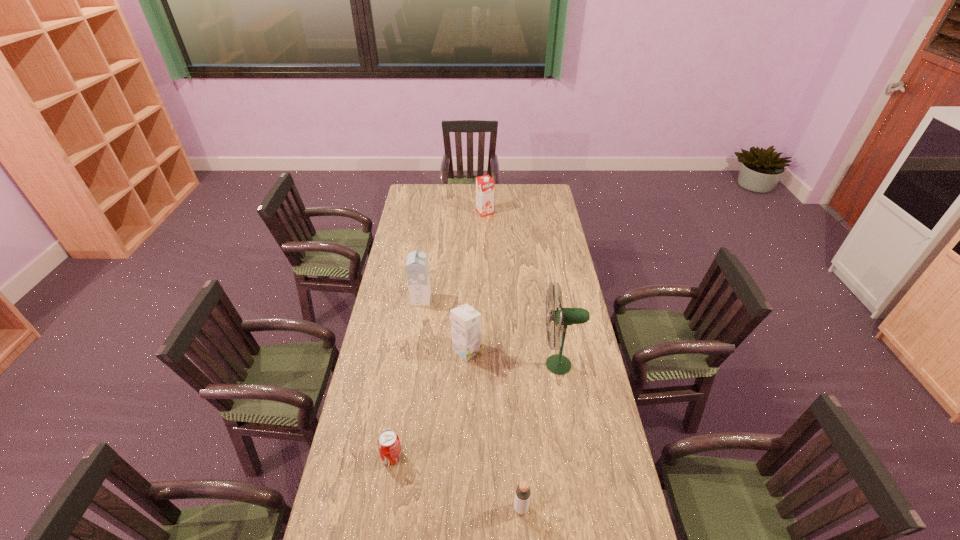
Identify the location of free point between the soda and the second farthest carton. The width and height of the screenshot is (960, 540). (407, 378).

This screenshot has height=540, width=960. Identify the location of free space that is in between the nearest carton and the fifth object from left to right. (494, 429).

Find the location of a particular element. The image size is (960, 540). free point between the soda and the bottle is located at coordinates (457, 483).

Where is `free area in between the fifth object from left to right and the second farthest carton`? This screenshot has height=540, width=960. free area in between the fifth object from left to right and the second farthest carton is located at coordinates (471, 404).

I want to click on unoccupied area between the soda and the second shortest object, so click(x=457, y=483).

Identify which object is located as the nearest to the second nearest object. Please provide its 2D coordinates. Your answer should be formatted as a tuple, i.e. [(x, y)], where the tuple contains the x and y coordinates of a point satisfying the conditions above.

[(523, 491)]

At what (x,y) coordinates should I click in order to perform the action: click on object that ranks as the closest to the farthest carton. Please return your answer as a coordinate pair (x, y). This screenshot has height=540, width=960. Looking at the image, I should click on (417, 269).

Find the location of a particular element. The width and height of the screenshot is (960, 540). the closest carton to the second nearest object is located at coordinates (465, 321).

Identify the location of carton identified as the closest to the fifth farthest object. The height and width of the screenshot is (540, 960). (465, 321).

At what (x,y) coordinates should I click in order to perform the action: click on free space that satisfies the following two spatial constraints: 1. on the front label of the fifth nearest object; 2. on the right side of the nearest object. Please return your answer as a coordinate pair (x, y). The height and width of the screenshot is (540, 960). Looking at the image, I should click on (391, 508).